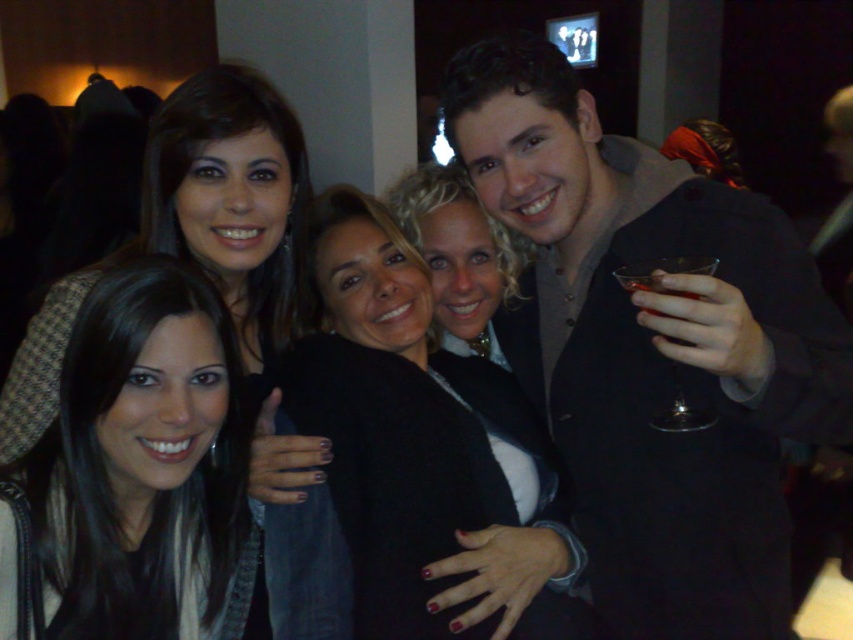
You are a photographer trying to capture a group photo of the black fuzzy sweater at center and the translucent glass at upper right. Since you want to ensure both are clearly visible, which object should you focus on first considering their sizes?

The black fuzzy sweater at center is wider than the translucent glass at upper right, so you should focus on the black fuzzy sweater at center first to ensure it is clearly visible.

You are a photographer trying to adjust the lighting for the group photo. You notice the transparent glass at right and the matte black jacket at upper left. Which object is closer to the camera?

The matte black jacket at upper left is closer to the camera because the transparent glass at right is behind it.

You are a photographer trying to adjust the lighting for a photo of the matte black jacket at upper left and the transparent glass at right. Since the venue is dimly lit, you need to ensure both objects are well lit. Based on their positions, which object should you focus the light on first to avoid shadows affecting the other object?

The matte black jacket at upper left is below the transparent glass at right. Since the glass is above it, focusing the light on the transparent glass at right first will help illuminate both objects without casting shadows on the matte black jacket at upper left below.